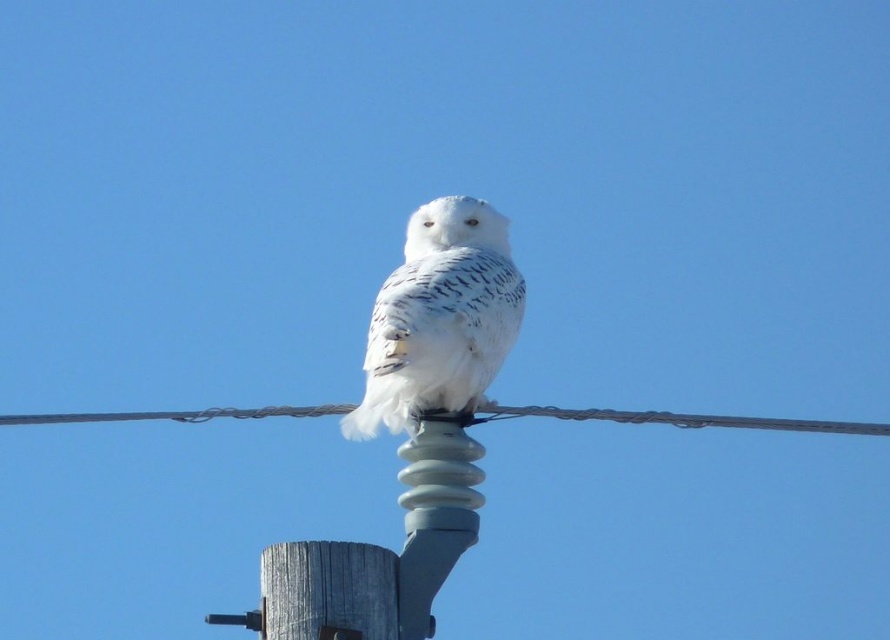
Does white fluffy owl at center appear on the right side of wooden post at lower left?

Correct, you'll find white fluffy owl at center to the right of wooden post at lower left.

Does point (464, 340) lie in front of point (373, 593)?

No.

The image size is (890, 640). In order to click on white fluffy owl at center in this screenshot , I will do `click(439, 317)`.

Who is more forward, (460, 490) or (356, 586)?

Point (356, 586) is more forward.

Does gray rubber insulator at center have a lesser width compared to wooden post at lower left?

Yes, gray rubber insulator at center is thinner than wooden post at lower left.

Locate an element on the screen. The image size is (890, 640). gray rubber insulator at center is located at coordinates (434, 515).

Can you confirm if white fluffy owl at center is thinner than black wire at center?

Yes, white fluffy owl at center is thinner than black wire at center.

Is white fluffy owl at center wider than black wire at center?

In fact, white fluffy owl at center might be narrower than black wire at center.

Is point (490, 257) positioned before point (241, 410)?

That is True.

Image resolution: width=890 pixels, height=640 pixels. Find the location of `white fluffy owl at center`. white fluffy owl at center is located at coordinates (439, 317).